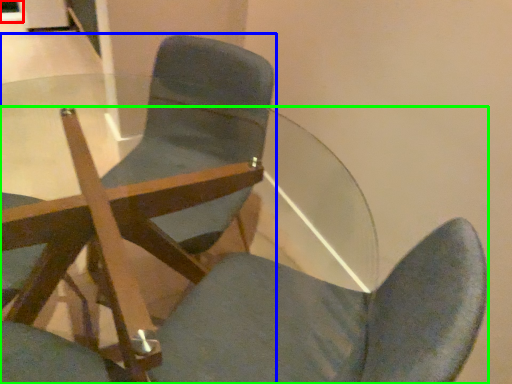
Question: Considering the real-world distances, which object is closest to glass door (highlighted by a red box)? chair (highlighted by a blue box) or chair (highlighted by a green box).

Choices:
 (A) chair
 (B) chair

Answer: (A)